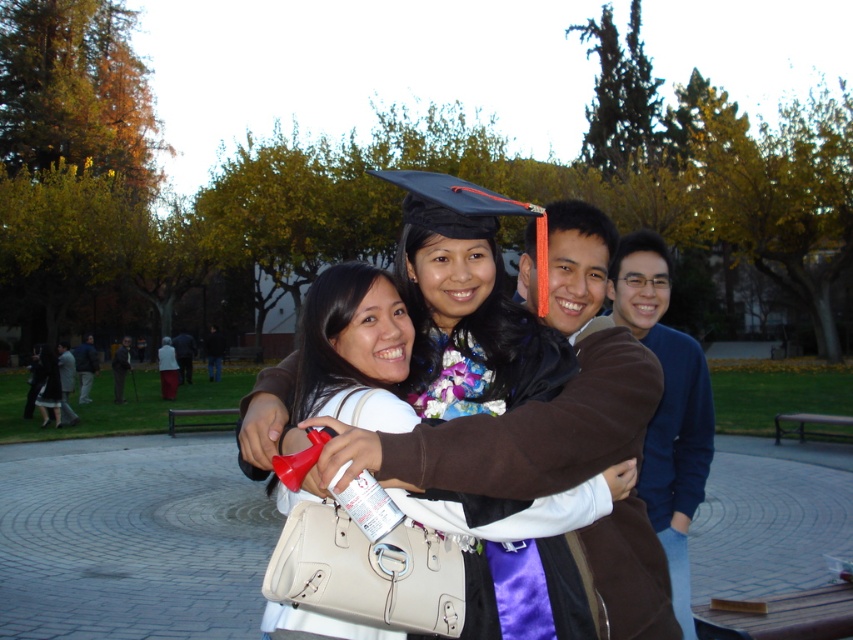
Is matte black gown at center taller than light gray wool coat at lower left?

No.

Between point (518, 365) and point (67, 364), which one is positioned behind?

The point (67, 364) is more distant.

Who is more distant from viewer, (465, 360) or (64, 422)?

Positioned behind is point (64, 422).

This screenshot has width=853, height=640. I want to click on matte black gown at center, so click(x=525, y=589).

Between light gray wool coat at lower left and dark blue jacket at center, which one is positioned lower?

Positioned lower is light gray wool coat at lower left.

Is light gray wool coat at lower left below dark blue jacket at center?

Indeed, light gray wool coat at lower left is positioned under dark blue jacket at center.

Who is more distant from viewer, (62, 417) or (88, 348)?

Point (88, 348)

Find the location of a particular element. This screenshot has width=853, height=640. light gray wool coat at lower left is located at coordinates (67, 381).

Consider the image. Can you confirm if matte black graduation cap at center is smaller than blue cotton sweater at right?

Indeed, matte black graduation cap at center has a smaller size compared to blue cotton sweater at right.

Does point (485, 589) come in front of point (706, 438)?

Yes, point (485, 589) is closer to viewer.

Find the location of a particular element. Image resolution: width=853 pixels, height=640 pixels. matte black graduation cap at center is located at coordinates (469, 305).

At what (x,y) coordinates should I click in order to perform the action: click on matte black graduation cap at center. Please return your answer as a coordinate pair (x, y). The height and width of the screenshot is (640, 853). Looking at the image, I should click on click(x=469, y=305).